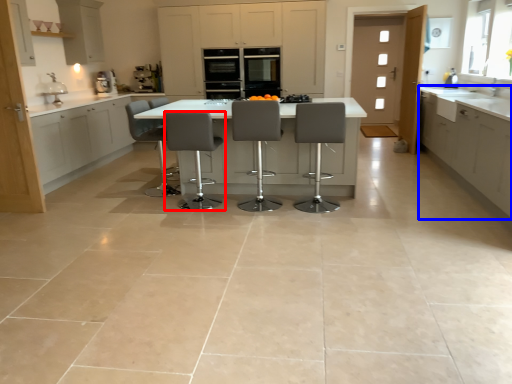
Question: Among these objects, which one is nearest to the camera, chair (highlighted by a red box) or cabinetry (highlighted by a blue box)?

Choices:
 (A) chair
 (B) cabinetry

Answer: (B)